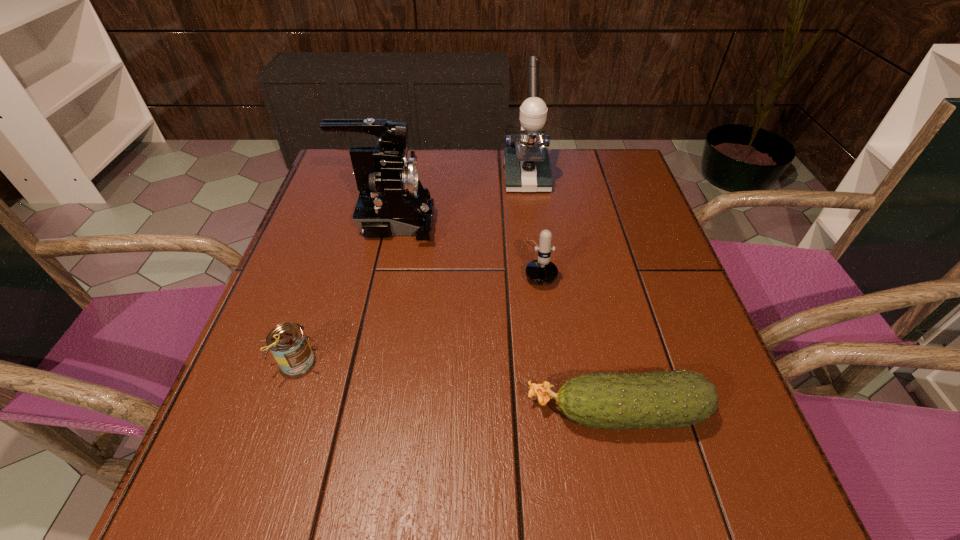
The width and height of the screenshot is (960, 540). I want to click on free space between the camcorder and the farthest object, so (x=459, y=200).

At what (x,y) coordinates should I click in order to perform the action: click on vacant area between the microscope and the cucumber. Please return your answer as a coordinate pair (x, y). Looking at the image, I should click on (571, 294).

You are a GUI agent. You are given a task and a screenshot of the screen. Output one action in this format:
    pyautogui.click(x=<x>, y=<y>)
    Task: Click on the free space between the second tallest object and the microphone
    
    Given the screenshot: What is the action you would take?
    pyautogui.click(x=465, y=242)

I want to click on object that is the third closest to the cucumber, so click(392, 201).

The width and height of the screenshot is (960, 540). I want to click on the closest object relative to the can, so click(x=392, y=201).

Locate an element on the screen. The height and width of the screenshot is (540, 960). free location that satisfies the following two spatial constraints: 1. on the lens mount of the camcorder; 2. on the left side of the microphone is located at coordinates (382, 262).

Where is `vacant area in the image that satisfies the following two spatial constraints: 1. on the lens mount of the camcorder; 2. on the front side of the second nearest object`? vacant area in the image that satisfies the following two spatial constraints: 1. on the lens mount of the camcorder; 2. on the front side of the second nearest object is located at coordinates (360, 361).

The width and height of the screenshot is (960, 540). What are the coordinates of `vacant area in the image that satisfies the following two spatial constraints: 1. on the back side of the microscope; 2. on the right side of the can` in the screenshot? It's located at (359, 177).

At what (x,y) coordinates should I click in order to perform the action: click on free region that satisfies the following two spatial constraints: 1. on the lens mount of the microphone; 2. on the right side of the fourth shortest object. Please return your answer as a coordinate pair (x, y). Looking at the image, I should click on (382, 262).